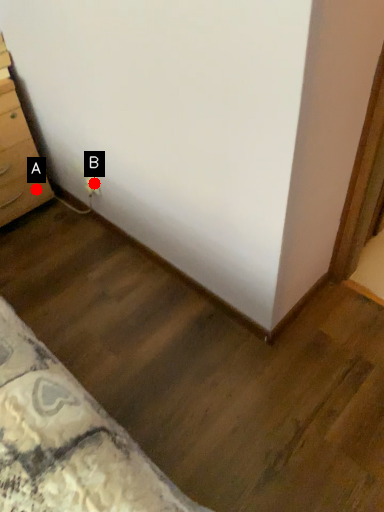
Question: Two points are circled on the image, labeled by A and B beside each circle. Among these points, which one is farthest from the camera?

Choices:
 (A) A is further
 (B) B is further

Answer: (A)